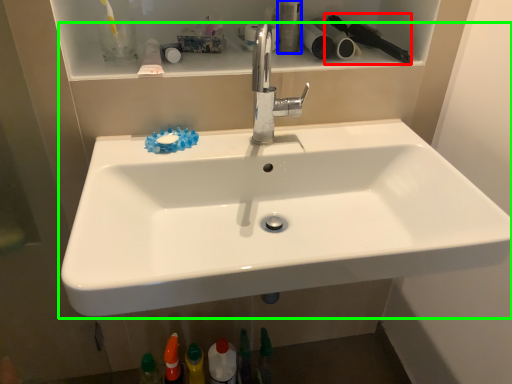
Question: Which is farther away from brush (highlighted by a red box)? toiletry (highlighted by a blue box) or sink (highlighted by a green box)?

Choices:
 (A) toiletry
 (B) sink

Answer: (B)